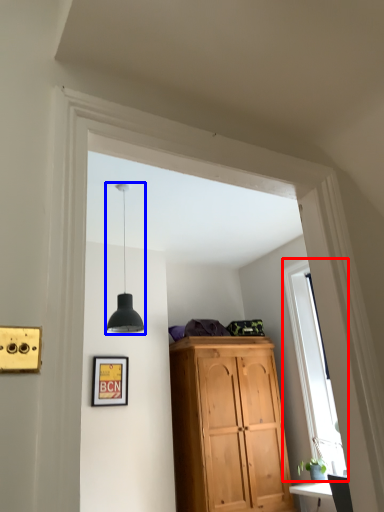
Question: Which object is closer to the camera taking this photo, window (highlighted by a red box) or light fixture (highlighted by a blue box)?

Choices:
 (A) window
 (B) light fixture

Answer: (B)